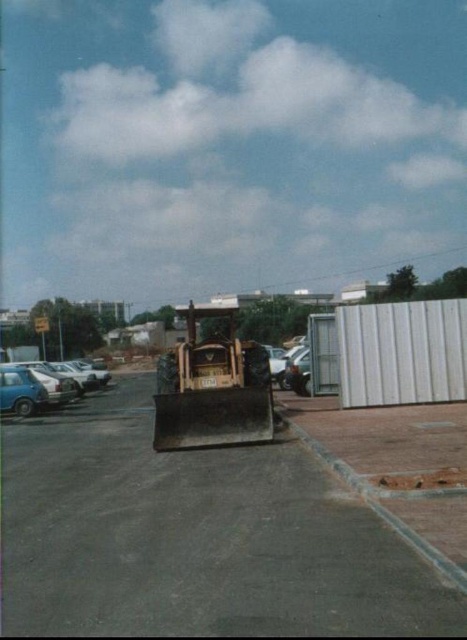
The width and height of the screenshot is (467, 640). What do you see at coordinates (212, 387) in the screenshot? I see `metallic yellow excavator at center` at bounding box center [212, 387].

Between point (253, 397) and point (62, 401), which one is positioned behind?

Point (62, 401)

You are a GUI agent. You are given a task and a screenshot of the screen. Output one action in this format:
    pyautogui.click(x=<x>, y=<y>)
    Task: Click on the metallic yellow excavator at center
    This screenshot has height=640, width=467.
    Given the screenshot: What is the action you would take?
    pyautogui.click(x=212, y=387)

Does concrete asphalt parking lot at center have a smaller size compared to metallic yellow excavator at center?

Yes, concrete asphalt parking lot at center is smaller than metallic yellow excavator at center.

Image resolution: width=467 pixels, height=640 pixels. What do you see at coordinates (195, 538) in the screenshot? I see `concrete asphalt parking lot at center` at bounding box center [195, 538].

The width and height of the screenshot is (467, 640). In order to click on concrete asphalt parking lot at center in this screenshot , I will do `click(195, 538)`.

Does point (141, 627) come behind point (91, 380)?

No, it is in front of (91, 380).

Is concrete asphalt parking lot at center behind matte blue car at left?

No.

Is point (129, 609) closer to camera compared to point (7, 410)?

Yes, point (129, 609) is closer to viewer.

Where is `concrete asphalt parking lot at center`? This screenshot has height=640, width=467. concrete asphalt parking lot at center is located at coordinates (195, 538).